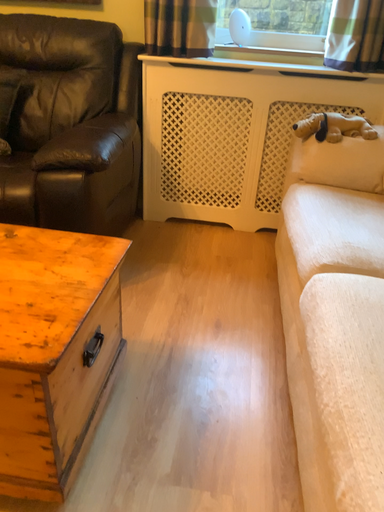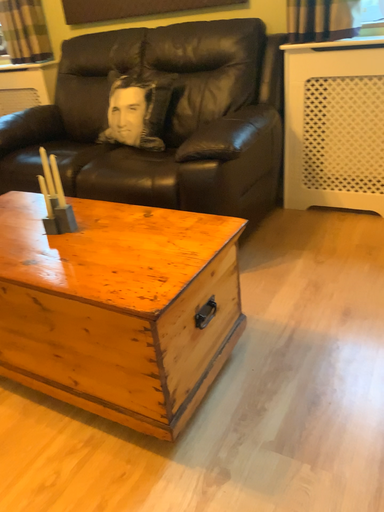
Question: How did the camera likely rotate when shooting the video?

Choices:
 (A) rotated left
 (B) rotated right

Answer: (A)